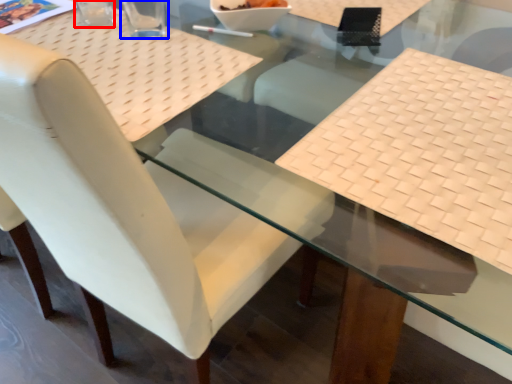
Question: Which object appears closest to the camera in this image, clear (highlighted by a red box) or clear (highlighted by a blue box)?

Choices:
 (A) clear
 (B) clear

Answer: (B)